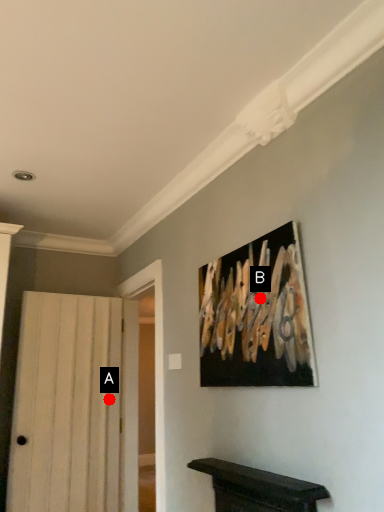
Question: Two points are circled on the image, labeled by A and B beside each circle. Which point is farther from the camera taking this photo?

Choices:
 (A) A is further
 (B) B is further

Answer: (A)